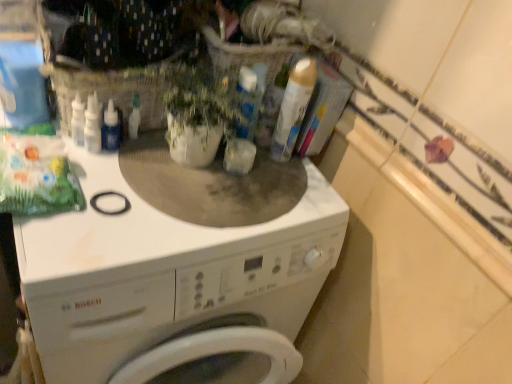
Question: From a real-world perspective, is gold metallic can at upper center beneath white glossy counter top at upper right?

Choices:
 (A) no
 (B) yes

Answer: (A)

Question: From a real-world perspective, is gold metallic can at upper center physically above white glossy counter top at upper right?

Choices:
 (A) no
 (B) yes

Answer: (B)

Question: Is gold metallic can at upper center not inside white glossy counter top at upper right?

Choices:
 (A) yes
 (B) no

Answer: (A)

Question: Does gold metallic can at upper center come behind white glossy counter top at upper right?

Choices:
 (A) yes
 (B) no

Answer: (A)

Question: Considering the relative sizes of gold metallic can at upper center and white glossy counter top at upper right in the image provided, is gold metallic can at upper center smaller than white glossy counter top at upper right?

Choices:
 (A) yes
 (B) no

Answer: (B)

Question: Considering the positions of green matte plant at center and white matte washing machine at center in the image, is green matte plant at center wider or thinner than white matte washing machine at center?

Choices:
 (A) wide
 (B) thin

Answer: (B)

Question: From a real-world perspective, is green matte plant at center physically located above or below white matte washing machine at center?

Choices:
 (A) below
 (B) above

Answer: (B)

Question: Looking at the image, does green matte plant at center seem bigger or smaller compared to white matte washing machine at center?

Choices:
 (A) big
 (B) small

Answer: (B)

Question: From the image's perspective, is green matte plant at center positioned above or below white matte washing machine at center?

Choices:
 (A) above
 (B) below

Answer: (A)

Question: Is point (373, 180) closer or farther from the camera than point (101, 147)?

Choices:
 (A) closer
 (B) farther

Answer: (B)

Question: From a real-world perspective, is white glossy counter top at upper right positioned above or below transparent plastic bottle at center?

Choices:
 (A) below
 (B) above

Answer: (B)

Question: Considering the positions of white glossy counter top at upper right and transparent plastic bottle at center in the image, is white glossy counter top at upper right taller or shorter than transparent plastic bottle at center?

Choices:
 (A) short
 (B) tall

Answer: (A)

Question: Considering the relative positions of white glossy counter top at upper right and transparent plastic bottle at center in the image provided, is white glossy counter top at upper right to the left or to the right of transparent plastic bottle at center?

Choices:
 (A) left
 (B) right

Answer: (B)

Question: Relative to white glossy counter top at upper right, is white matte washing machine at center in front or behind?

Choices:
 (A) behind
 (B) front

Answer: (B)

Question: Is white matte washing machine at center taller or shorter than white glossy counter top at upper right?

Choices:
 (A) tall
 (B) short

Answer: (A)